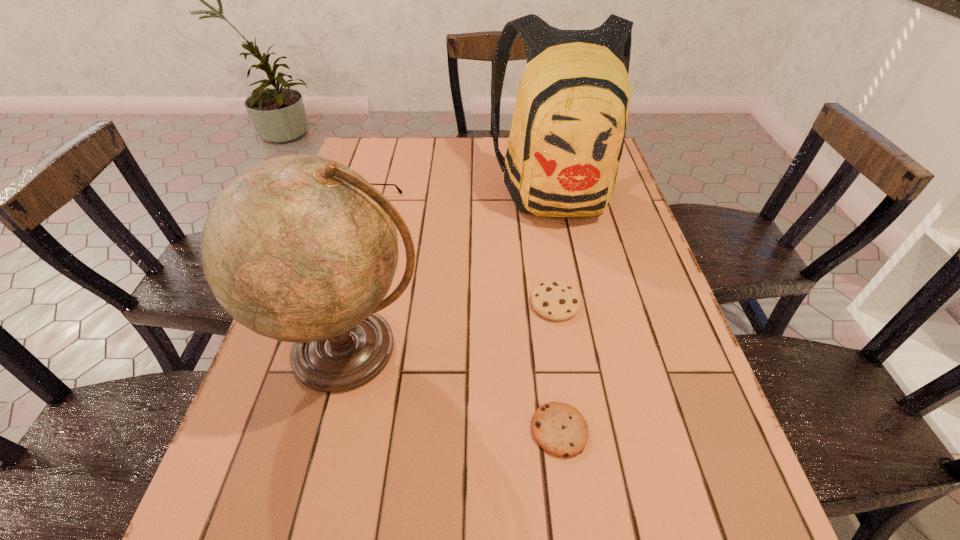
The width and height of the screenshot is (960, 540). What are the coordinates of `free space between the spectacles and the nearer cookie` in the screenshot? It's located at (465, 321).

This screenshot has width=960, height=540. Find the location of `free space between the fourth tallest object and the third shortest object`. free space between the fourth tallest object and the third shortest object is located at coordinates (463, 257).

I want to click on vacant space in between the taller cookie and the globe, so click(x=452, y=327).

Where is `free spot between the globe and the shortest object`? This screenshot has height=540, width=960. free spot between the globe and the shortest object is located at coordinates (454, 390).

You are a GUI agent. You are given a task and a screenshot of the screen. Output one action in this format:
    pyautogui.click(x=<x>, y=<y>)
    Task: Click on the free space between the farther cookie and the spectacles
    The width and height of the screenshot is (960, 540).
    Given the screenshot: What is the action you would take?
    pyautogui.click(x=463, y=257)

I want to click on vacant area that lies between the globe and the shortest object, so click(454, 390).

Locate an element on the screen. The image size is (960, 540). vacant area between the taller cookie and the backpack is located at coordinates (556, 246).

You are a GUI agent. You are given a task and a screenshot of the screen. Output one action in this format:
    pyautogui.click(x=<x>, y=<y>)
    Task: Click on the empty location between the taller cookie and the backpack
    The height and width of the screenshot is (540, 960).
    Given the screenshot: What is the action you would take?
    pyautogui.click(x=556, y=246)

Find the location of `free space between the second shortest object and the backpack`. free space between the second shortest object and the backpack is located at coordinates (556, 246).

Locate which object ranks second in proximity to the fourth tallest object. Please provide its 2D coordinates. Your answer should be formatted as a tuple, i.e. [(x, y)], where the tuple contains the x and y coordinates of a point satisfying the conditions above.

[(560, 429)]